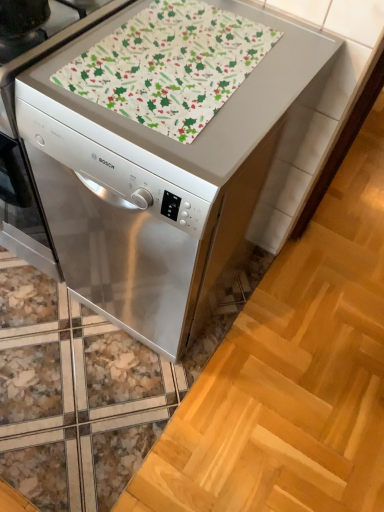
Question: Considering the positions of satin silver dishwasher at center and patterned fabric at center in the image, is satin silver dishwasher at center bigger or smaller than patterned fabric at center?

Choices:
 (A) big
 (B) small

Answer: (A)

Question: From a real-world perspective, is satin silver dishwasher at center positioned above or below patterned fabric at center?

Choices:
 (A) above
 (B) below

Answer: (B)

Question: Visually, is satin silver dishwasher at center positioned to the left or to the right of patterned fabric at center?

Choices:
 (A) right
 (B) left

Answer: (B)

Question: In terms of width, does patterned fabric at center look wider or thinner when compared to satin silver dishwasher at center?

Choices:
 (A) wide
 (B) thin

Answer: (B)

Question: Looking at the image, does patterned fabric at center seem bigger or smaller compared to satin silver dishwasher at center?

Choices:
 (A) big
 (B) small

Answer: (B)

Question: From a real-world perspective, relative to satin silver dishwasher at center, is patterned fabric at center vertically above or below?

Choices:
 (A) below
 (B) above

Answer: (B)

Question: From the image's perspective, is patterned fabric at center positioned above or below satin silver dishwasher at center?

Choices:
 (A) above
 (B) below

Answer: (A)